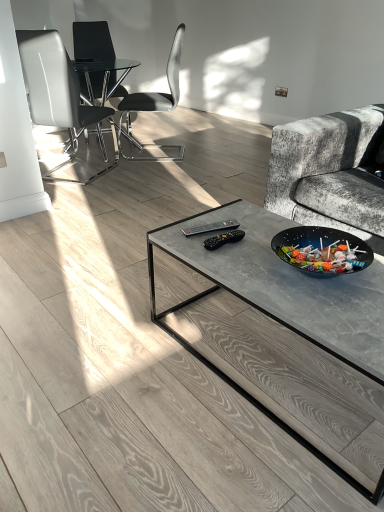
The width and height of the screenshot is (384, 512). Identify the location of vacant space to the right of white leather chair at left, which is the 3th chair in back-to-front order. (134, 170).